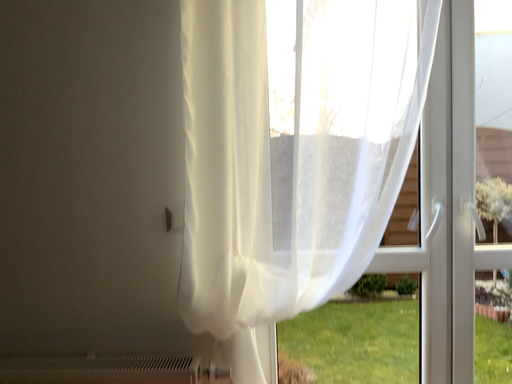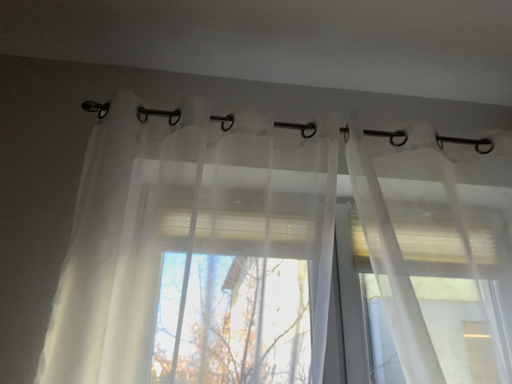
Question: Which way did the camera rotate in the video?

Choices:
 (A) rotated right
 (B) rotated left

Answer: (A)